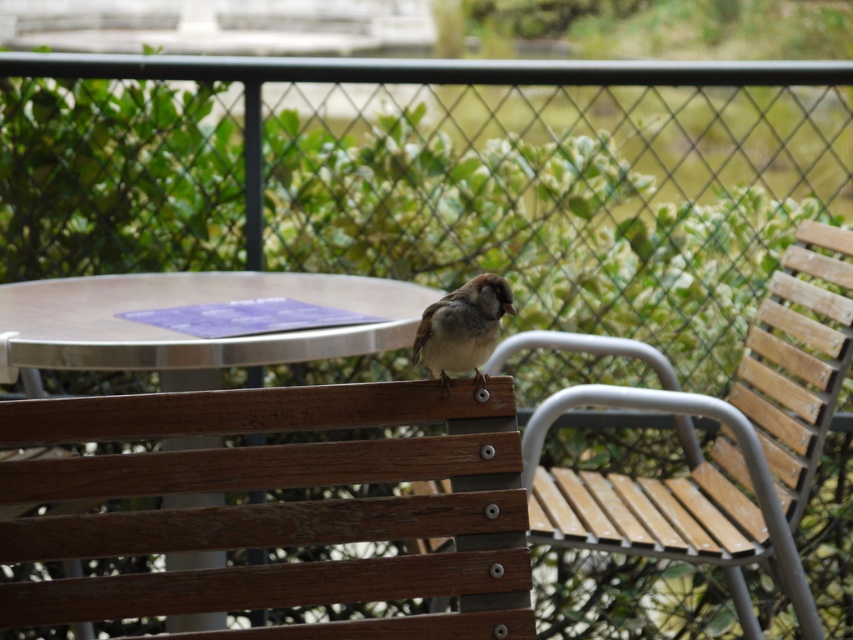
Who is positioned more to the left, wooden slats bench at center or wooden slats at center?

From the viewer's perspective, wooden slats bench at center appears more on the left side.

Is wooden slats bench at center smaller than wooden slats at center?

Correct, wooden slats bench at center occupies less space than wooden slats at center.

Which is behind, point (410, 401) or point (769, 420)?

The point (769, 420) is behind.

I want to click on wooden slats bench at center, so click(276, 508).

Does wooden slats at center appear on the left side of metallic silver table at center?

No, wooden slats at center is not to the left of metallic silver table at center.

Based on the photo, is wooden slats at center shorter than metallic silver table at center?

No.

Is point (791, 362) positioned in front of point (99, 300)?

No, it is behind (99, 300).

What are the coordinates of `wooden slats at center` in the screenshot? It's located at click(x=798, y=358).

This screenshot has height=640, width=853. What do you see at coordinates (798, 358) in the screenshot?
I see `wooden slats at center` at bounding box center [798, 358].

Can you confirm if wooden slats at center is bigger than brown feathered sparrow at center?

Yes.

Measure the distance between wooden slats at center and camera.

wooden slats at center and camera are 2.57 meters apart.

Where is `wooden slats at center`? wooden slats at center is located at coordinates (798, 358).